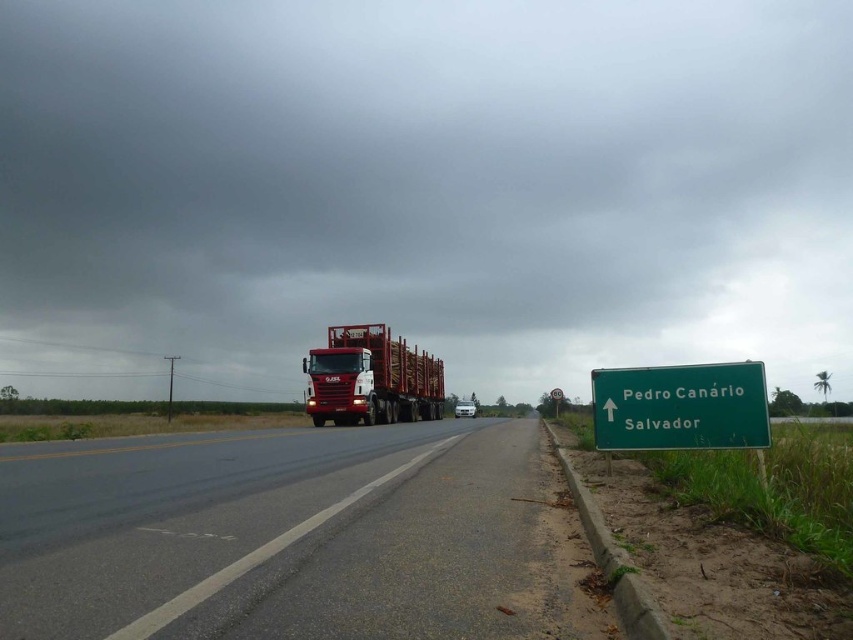
Between black asphalt road at center and metallic red trailer truck at center, which one has less height?

black asphalt road at center is shorter.

Is point (218, 600) closer to camera compared to point (351, 340)?

That is True.

Identify the location of black asphalt road at center. This screenshot has height=640, width=853. (294, 536).

Between dark gray cloud at upper center and metallic red trailer truck at center, which one is positioned higher?

dark gray cloud at upper center

Which of these two, dark gray cloud at upper center or metallic red trailer truck at center, stands shorter?

metallic red trailer truck at center

Image resolution: width=853 pixels, height=640 pixels. In order to click on dark gray cloud at upper center in this screenshot , I will do `click(422, 189)`.

Between green matte sign at right and metallic red trailer truck at center, which one appears on the right side from the viewer's perspective?

From the viewer's perspective, green matte sign at right appears more on the right side.

Is point (654, 387) farther from camera compared to point (300, 368)?

No.

Image resolution: width=853 pixels, height=640 pixels. What are the coordinates of `green matte sign at right` in the screenshot? It's located at (680, 406).